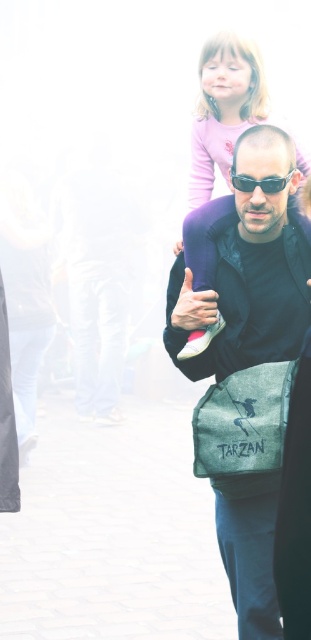
Question: Does matte black jacket at center have a larger size compared to sunglasses at center?

Choices:
 (A) no
 (B) yes

Answer: (B)

Question: Considering the relative positions of pink fabric dress at upper center and textured gray bag at center in the image provided, where is pink fabric dress at upper center located with respect to textured gray bag at center?

Choices:
 (A) left
 (B) right

Answer: (A)

Question: Which object appears closest to the camera in this image?

Choices:
 (A) matte black jacket at center
 (B) sunglasses at center
 (C) textured gray bag at center
 (D) pink fabric dress at upper center

Answer: (C)

Question: Which point is farther from the camera taking this photo?

Choices:
 (A) (238, 180)
 (B) (244, 396)
 (C) (203, 337)
 (D) (233, 362)

Answer: (D)

Question: Does matte black jacket at center have a larger size compared to pink fabric dress at upper center?

Choices:
 (A) no
 (B) yes

Answer: (B)

Question: Among these points, which one is farthest from the camera?

Choices:
 (A) (236, 177)
 (B) (250, 416)
 (C) (195, 246)
 (D) (292, 308)

Answer: (C)